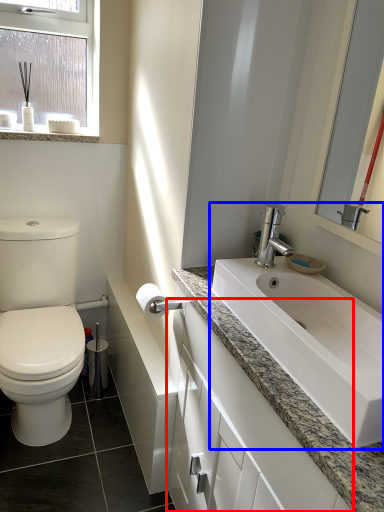
Question: Which point is further to the camera, bathroom cabinet (highlighted by a red box) or sink (highlighted by a blue box)?

Choices:
 (A) bathroom cabinet
 (B) sink

Answer: (B)